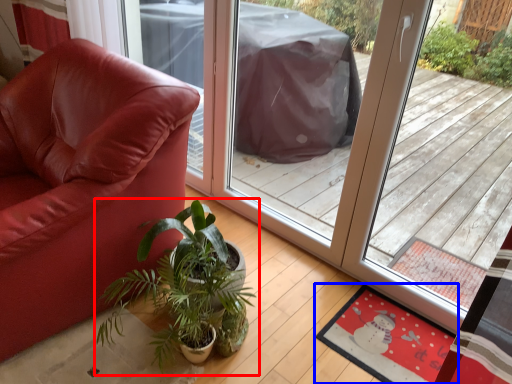
Question: Among these objects, which one is nearest to the camera, houseplant (highlighted by a red box) or mat (highlighted by a blue box)?

Choices:
 (A) houseplant
 (B) mat

Answer: (A)